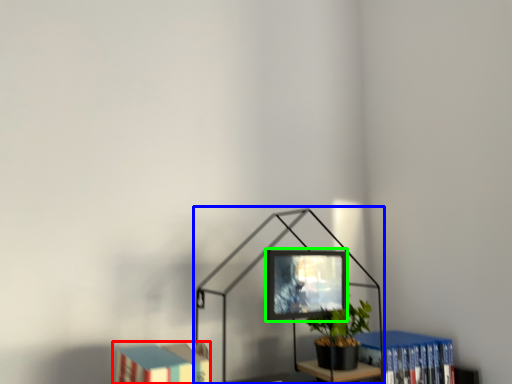
Question: Based on their relative distances, which object is nearer to book (highlighted by a red box)? Choose from table lamp (highlighted by a blue box) and computer monitor (highlighted by a green box).

Choices:
 (A) table lamp
 (B) computer monitor

Answer: (A)